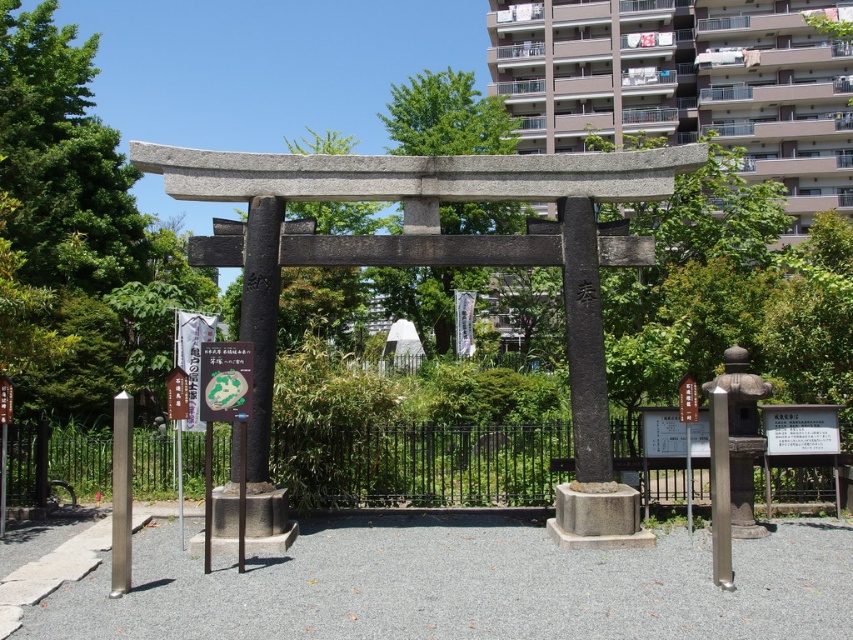
Question: Which is farther from the green leafy tree at center?

Choices:
 (A) wooden signpost at center
 (B) green paper at center

Answer: (A)

Question: Does green paper at center appear on the right side of wooden signpost at center?

Choices:
 (A) yes
 (B) no

Answer: (B)

Question: Which point is farther to the camera?

Choices:
 (A) silver metallic pole at center
 (B) green paper at center
 (C) wooden signpost at center
 (D) green leafy tree at center

Answer: (D)

Question: Which object is positioned farthest from the silver metallic pole at center?

Choices:
 (A) green paper at center
 (B) wooden signpost at center

Answer: (A)

Question: Does green leafy tree at center have a larger size compared to green paper at center?

Choices:
 (A) yes
 (B) no

Answer: (A)

Question: Is green leafy tree at center in front of wooden signpost at center?

Choices:
 (A) yes
 (B) no

Answer: (B)